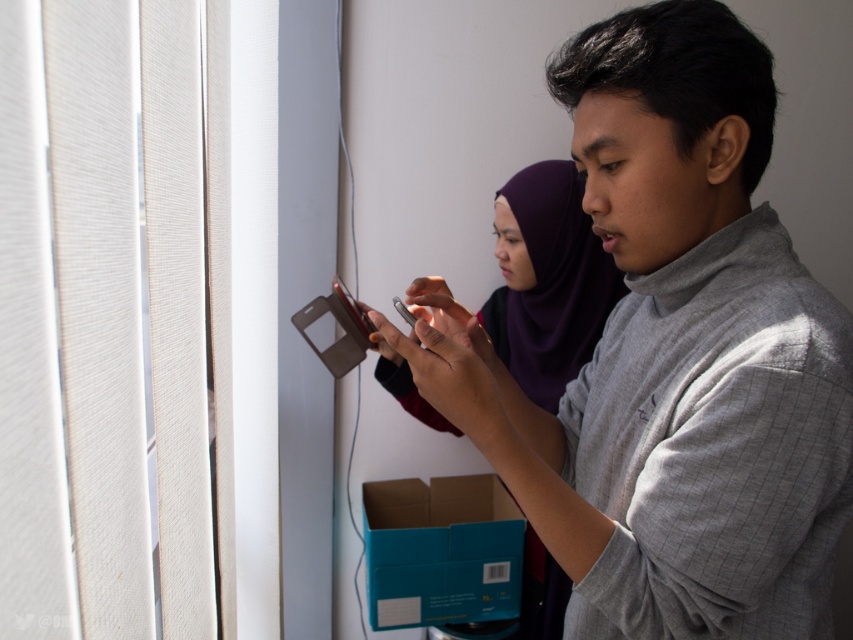
You are organizing a workspace and need to place the teal cardboard box at lower center and the white paper at lower center. Since you want the teal cardboard box to be more visible, should you place it closer or farther from your desk?

The teal cardboard box at lower center is already closer to the viewer than the white paper at lower center, so placing it closer to your desk would make it more visible.

From the picture: You are organizing a desk and have a teal cardboard box at lower center and a white paper at lower center. If you need to place a 7 inch ruler between them, will there be enough space?

The teal cardboard box at lower center is 6.96 inches from white paper at lower center. Since the ruler is 7 inches long, there is not enough space to place it between them.